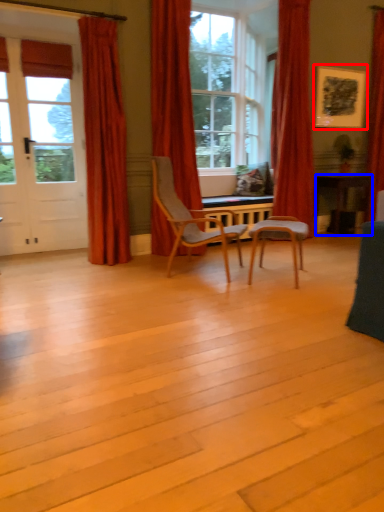
Question: Which of the following is the farthest to the observer, picture frame (highlighted by a red box) or desk (highlighted by a blue box)?

Choices:
 (A) picture frame
 (B) desk

Answer: (B)